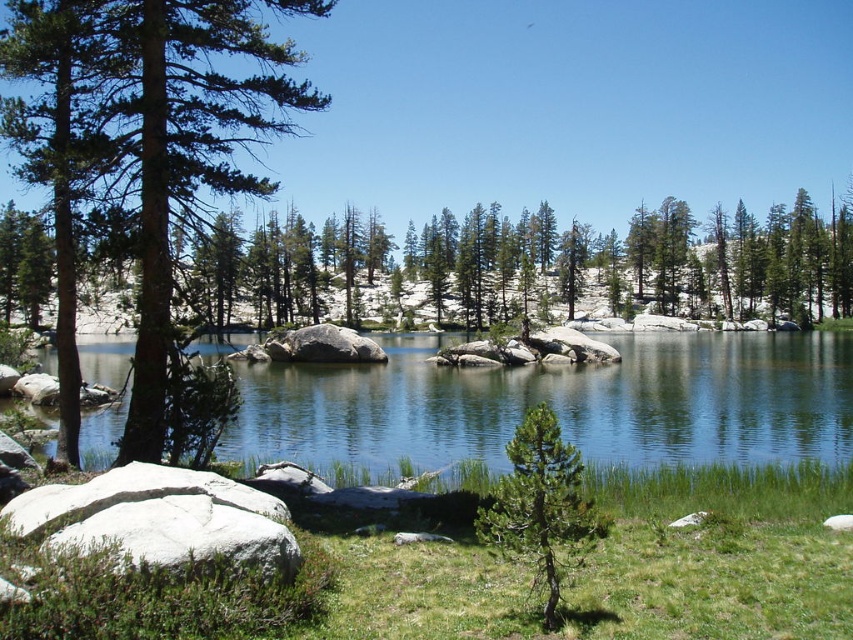
Between point (18, 124) and point (480, 524), which one is positioned in front?

Point (480, 524)

Can you confirm if green matte tree at left is positioned above green matte tree at center?

Correct, green matte tree at left is located above green matte tree at center.

Who is more distant from viewer, (181, 74) or (524, 504)?

The point (181, 74) is more distant.

Locate an element on the screen. green matte tree at left is located at coordinates (158, 129).

Which is below, clear blue water at center or green matte tree at left?

clear blue water at center is below.

Find the location of `clear blue water at center`. clear blue water at center is located at coordinates (556, 406).

I want to click on clear blue water at center, so click(556, 406).

Can you confirm if white rough boulder at lower left is positioned above green matte tree at center?

No.

Is white rough boulder at lower left to the left of green matte tree at center from the viewer's perspective?

Yes, white rough boulder at lower left is to the left of green matte tree at center.

Between point (53, 515) and point (546, 586), which one is positioned in front?

Point (546, 586) is in front.

Where is `white rough boulder at lower left`? white rough boulder at lower left is located at coordinates (158, 518).